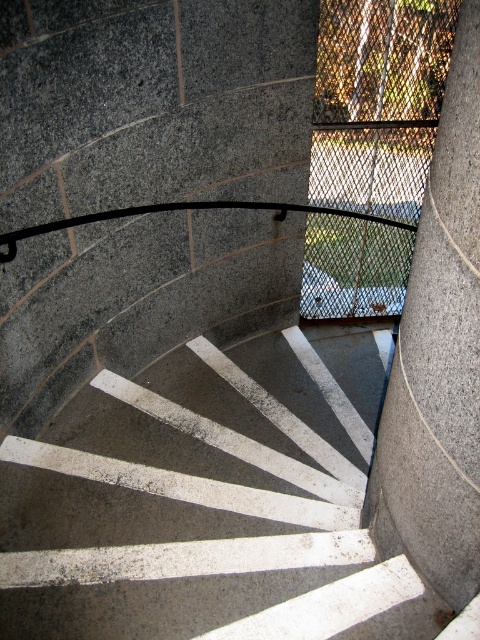
You are standing at the base of the spiral staircase and want to move towards the gray granite pillar at center. Which direction should you turn to walk towards it from the concrete stairs at center?

You should turn to your right to walk towards the gray granite pillar at center because the concrete stairs at center are to the left of the pillar.

You are standing at the top of the spiral staircase and want to walk down to the bottom. The point marked at coordinates (210, 502) is located on the concrete stairs at center. Which direction should you face to step onto the stairs from the top?

You should face towards the center of the spiral staircase to step onto the concrete stairs at center where the point is located.